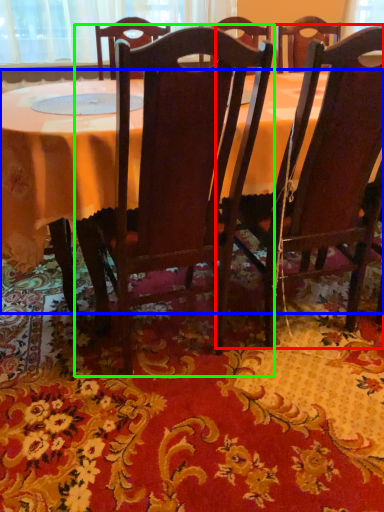
Question: Estimate the real-world distances between objects in this image. Which object is farther from chair (highlighted by a red box), table (highlighted by a blue box) or chair (highlighted by a green box)?

Choices:
 (A) table
 (B) chair

Answer: (A)